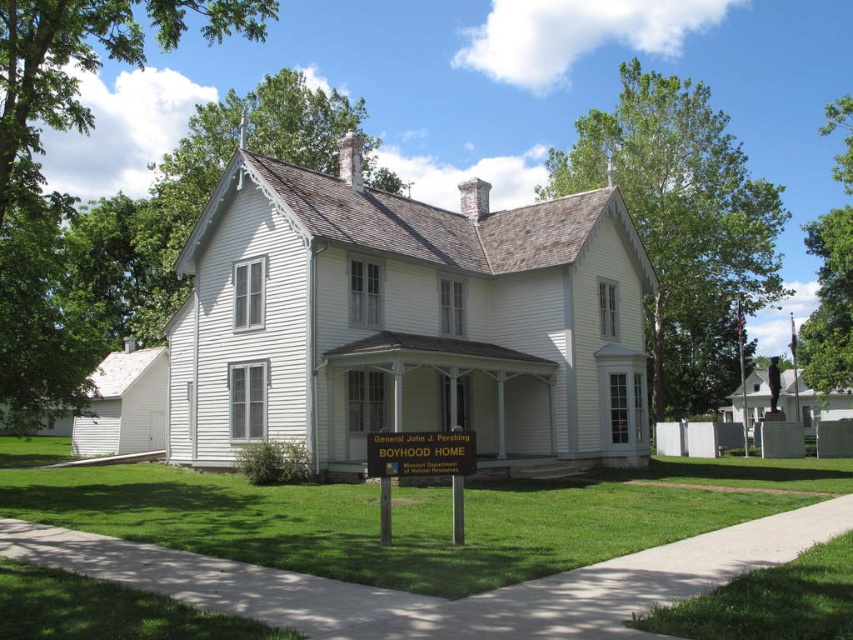
Question: Which is nearer to the metallic gold sign at center?

Choices:
 (A) green grass at center
 (B) green wooden sign at center

Answer: (B)

Question: Is green grass at center to the right of green wooden sign at center from the viewer's perspective?

Choices:
 (A) yes
 (B) no

Answer: (A)

Question: Is green grass at center bigger than metallic gold sign at center?

Choices:
 (A) no
 (B) yes

Answer: (B)

Question: Which object appears closest to the camera in this image?

Choices:
 (A) metallic gold sign at center
 (B) green grass at center
 (C) green wooden sign at center

Answer: (B)

Question: Estimate the real-world distances between objects in this image. Which object is closer to the green grass at center?

Choices:
 (A) metallic gold sign at center
 (B) green wooden sign at center

Answer: (B)

Question: Does green wooden sign at center appear on the right side of metallic gold sign at center?

Choices:
 (A) no
 (B) yes

Answer: (B)